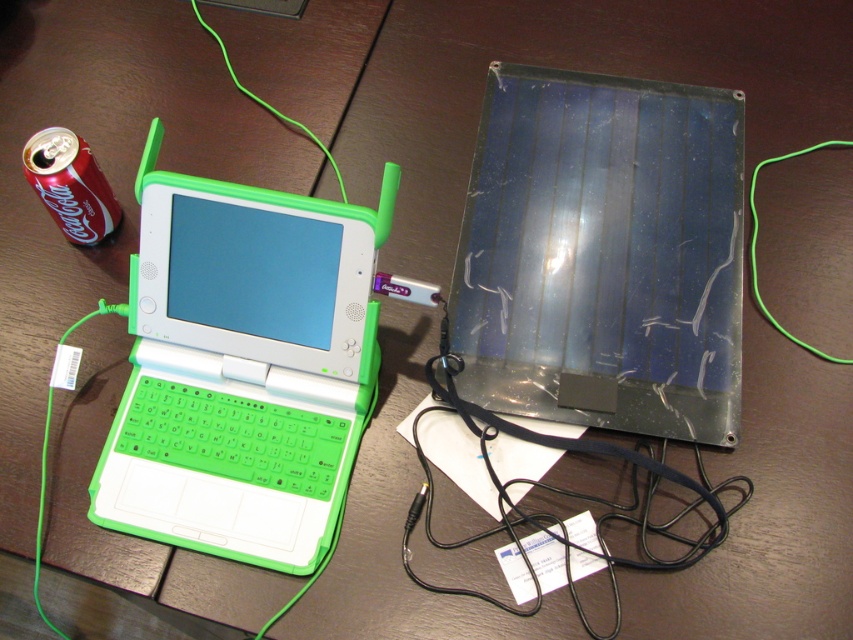
Question: Among these objects, which one is farthest from the camera?

Choices:
 (A) green matte laptop at left
 (B) transparent plastic solar panel at center

Answer: (B)

Question: Can you confirm if green matte laptop at left is positioned above red matte can at left?

Choices:
 (A) yes
 (B) no

Answer: (B)

Question: Observing the image, what is the correct spatial positioning of green matte laptop at left in reference to red matte can at left?

Choices:
 (A) below
 (B) above

Answer: (A)

Question: Estimate the real-world distances between objects in this image. Which object is closer to the red matte can at left?

Choices:
 (A) transparent plastic solar panel at center
 (B) green matte laptop at left

Answer: (B)

Question: Considering the real-world distances, which object is farthest from the red matte can at left?

Choices:
 (A) transparent plastic solar panel at center
 (B) green matte laptop at left

Answer: (A)

Question: Is transparent plastic solar panel at center further to camera compared to green matte laptop at left?

Choices:
 (A) no
 (B) yes

Answer: (B)